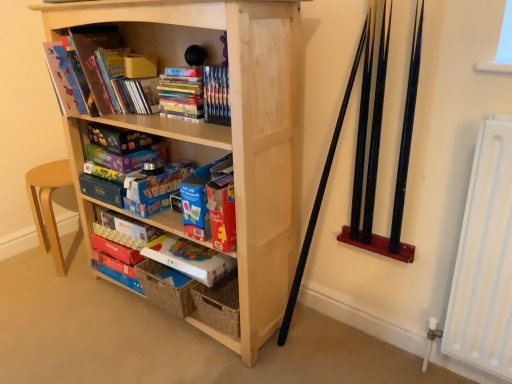
Question: Considering the relative sizes of white cardboard game box at center, the first paperback book when ordered from bottom to top, and matte blue board game at center, the 6th paperback book when ordered from bottom to top, in the image provided, is white cardboard game box at center, the first paperback book when ordered from bottom to top, wider than matte blue board game at center, the 6th paperback book when ordered from bottom to top,?

Choices:
 (A) no
 (B) yes

Answer: (B)

Question: Is white cardboard game box at center, the first paperback book when ordered from bottom to top, aimed at matte blue board game at center, the 6th paperback book when ordered from bottom to top?

Choices:
 (A) no
 (B) yes

Answer: (A)

Question: Is white cardboard game box at center, the first paperback book when ordered from bottom to top, at the left side of matte blue board game at center, the 6th paperback book when ordered from bottom to top?

Choices:
 (A) yes
 (B) no

Answer: (B)

Question: Is white cardboard game box at center, the sixth paperback book viewed from the top, next to matte blue board game at center, which appears as the first paperback book when viewed from the top?

Choices:
 (A) no
 (B) yes

Answer: (A)

Question: Are white cardboard game box at center, the first paperback book when ordered from bottom to top, and matte blue board game at center, the 6th paperback book when ordered from bottom to top, far apart?

Choices:
 (A) yes
 (B) no

Answer: (B)

Question: Considering the positions of natural wood bookcase at center and matte blue board game at center, the 6th paperback book when ordered from bottom to top, in the image, is natural wood bookcase at center taller or shorter than matte blue board game at center, the 6th paperback book when ordered from bottom to top,?

Choices:
 (A) short
 (B) tall

Answer: (B)

Question: Is natural wood bookcase at center inside the boundaries of matte blue board game at center, which appears as the first paperback book when viewed from the top, or outside?

Choices:
 (A) inside
 (B) outside

Answer: (B)

Question: From the image's perspective, is natural wood bookcase at center located above or below matte blue board game at center, which appears as the first paperback book when viewed from the top?

Choices:
 (A) below
 (B) above

Answer: (A)

Question: In terms of width, does natural wood bookcase at center look wider or thinner when compared to matte blue board game at center, the 6th paperback book when ordered from bottom to top?

Choices:
 (A) wide
 (B) thin

Answer: (A)

Question: From the image's perspective, is natural wood bookcase at center above or below white cardboard game box at center, the first paperback book when ordered from bottom to top?

Choices:
 (A) below
 (B) above

Answer: (B)

Question: From a real-world perspective, is natural wood bookcase at center positioned above or below white cardboard game box at center, the first paperback book when ordered from bottom to top?

Choices:
 (A) below
 (B) above

Answer: (B)

Question: Is point (65, 3) positioned closer to the camera than point (190, 273)?

Choices:
 (A) farther
 (B) closer

Answer: (B)

Question: Considering the positions of natural wood bookcase at center and white cardboard game box at center, the sixth paperback book viewed from the top, in the image, is natural wood bookcase at center wider or thinner than white cardboard game box at center, the sixth paperback book viewed from the top,?

Choices:
 (A) thin
 (B) wide

Answer: (B)

Question: Based on their sizes in the image, would you say red cardboard box at lower center, acting as the fifth paperback book starting from the top, is bigger or smaller than matte cardboard book at center, which is the 4th paperback book in top-to-bottom order?

Choices:
 (A) big
 (B) small

Answer: (B)

Question: Is point (115, 256) closer or farther from the camera than point (159, 235)?

Choices:
 (A) closer
 (B) farther

Answer: (B)